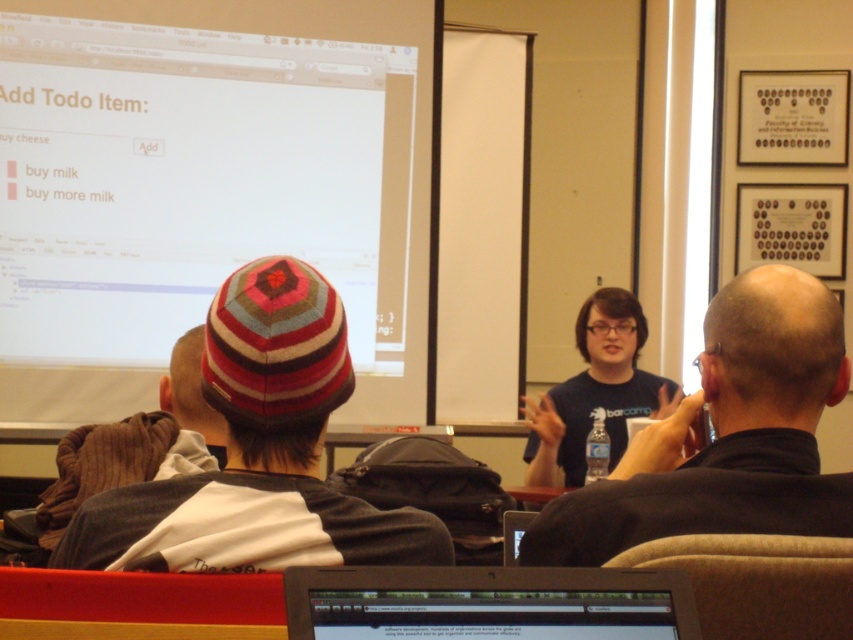
You are an attendee at the presentation. You need to take a photo of the white matte projection screen at upper left and the knitted woolen hat at center. Which object will appear larger in your photo?

The white matte projection screen at upper left will appear larger in the photo because it has a larger size compared to the knitted woolen hat at center.

You are sitting in the audience facing the presenter. There are two points marked in the room. The first point is at coordinate point(347, 596) and the second is at point(204, 432). Which point is closer to you?

Point(347, 596) is in front of point(204, 432), so the second point is closer to you.